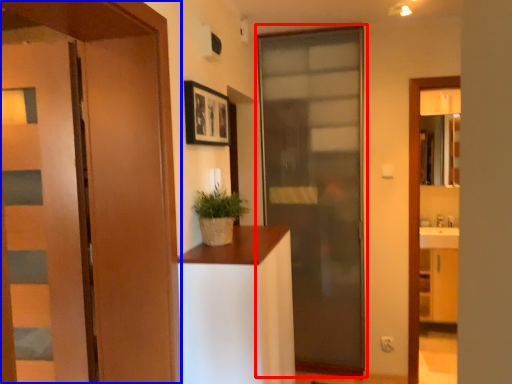
Question: Among these objects, which one is nearest to the camera, door (highlighted by a red box) or door (highlighted by a blue box)?

Choices:
 (A) door
 (B) door

Answer: (B)